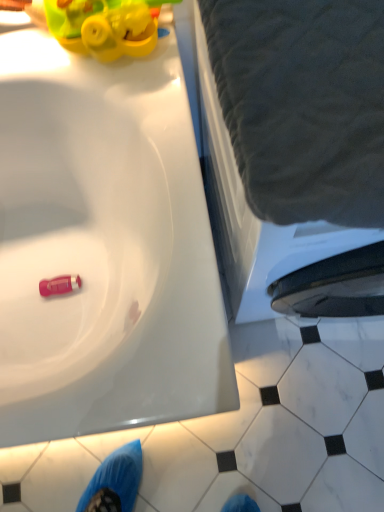
Question: Considering the positions of point (321, 504) and point (56, 287), is point (321, 504) closer or farther from the camera than point (56, 287)?

Choices:
 (A) farther
 (B) closer

Answer: (A)

Question: Choose the correct answer: Is white marble tile at lower right inside pink rubber toy at lower left or outside it?

Choices:
 (A) inside
 (B) outside

Answer: (B)

Question: Estimate the real-world distances between objects in this image. Which object is farther from the white marble tile at lower right?

Choices:
 (A) pink rubber toy at lower left
 (B) gray fabric at upper right

Answer: (A)

Question: Which object is the closest to the white marble tile at lower right?

Choices:
 (A) gray fabric at upper right
 (B) pink rubber toy at lower left

Answer: (A)